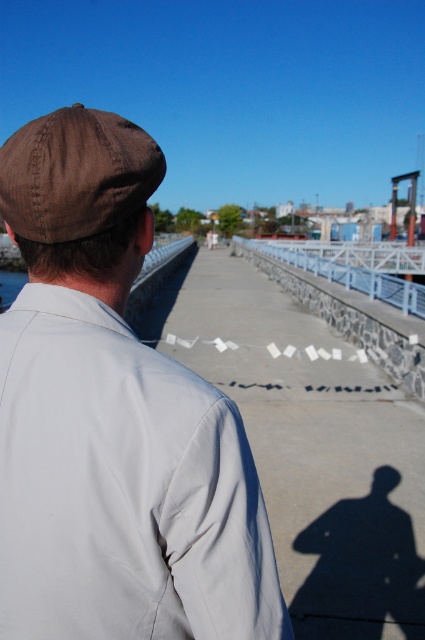
Question: Which object is positioned farthest from the brown fabric cap at upper left?

Choices:
 (A) white metal rail at center
 (B) brown fabric baseball cap at upper left

Answer: (A)

Question: Which object is the closest to the brown fabric baseball cap at upper left?

Choices:
 (A) brown fabric cap at upper left
 (B) white metal rail at center

Answer: (A)

Question: Can you confirm if brown fabric cap at upper left is wider than brown fabric baseball cap at upper left?

Choices:
 (A) no
 (B) yes

Answer: (A)

Question: Is brown fabric cap at upper left closer to camera compared to white metal rail at center?

Choices:
 (A) no
 (B) yes

Answer: (B)

Question: Does brown fabric cap at upper left appear over brown fabric baseball cap at upper left?

Choices:
 (A) no
 (B) yes

Answer: (A)

Question: Estimate the real-world distances between objects in this image. Which object is farther from the white metal rail at center?

Choices:
 (A) brown fabric baseball cap at upper left
 (B) brown fabric cap at upper left

Answer: (A)